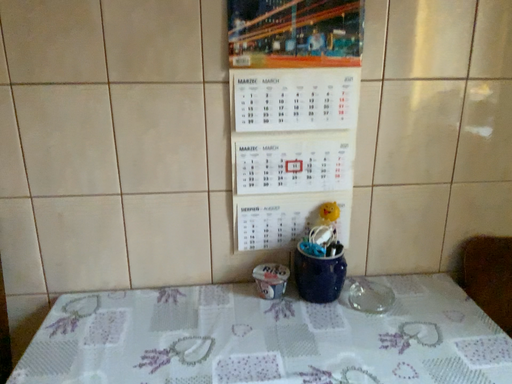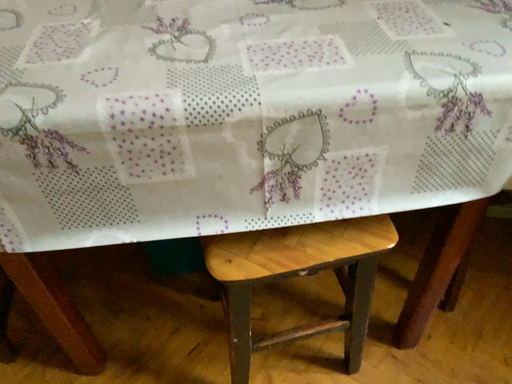
Question: Which way did the camera rotate in the video?

Choices:
 (A) rotated downward
 (B) rotated upward

Answer: (A)